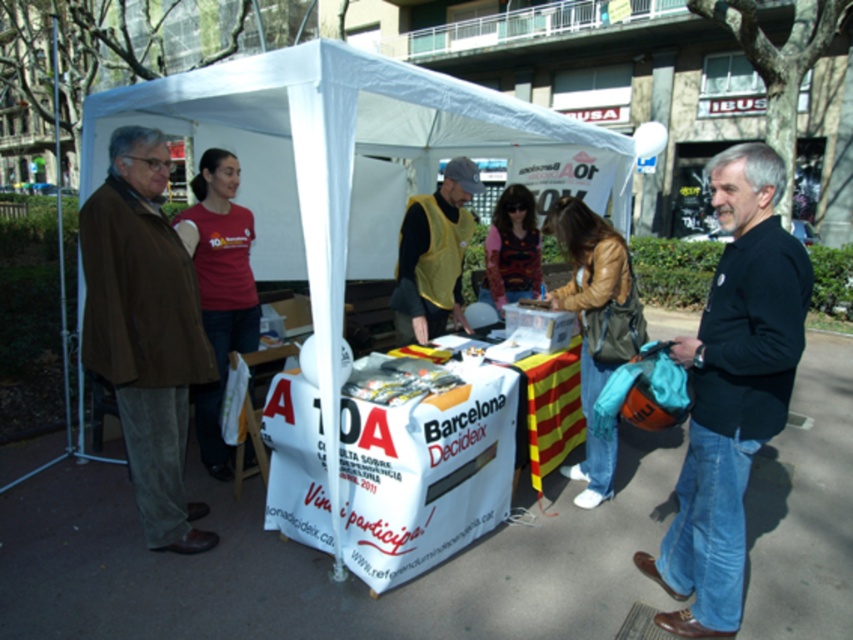
Question: Estimate the real-world distances between objects in this image. Which object is farther from the black matte shirt at right?

Choices:
 (A) yellow vest at center
 (B) brown corduroy jacket at left

Answer: (B)

Question: Which point is farther to the camera?

Choices:
 (A) brown corduroy jacket at left
 (B) white fabric canopy at center
 (C) yellow vest at center
 (D) black matte shirt at right

Answer: (C)

Question: Can you confirm if brown corduroy jacket at left is positioned below yellow vest at center?

Choices:
 (A) no
 (B) yes

Answer: (B)

Question: Estimate the real-world distances between objects in this image. Which object is farther from the brown corduroy jacket at left?

Choices:
 (A) black matte shirt at right
 (B) white fabric canopy at center
 (C) yellow vest at center

Answer: (A)

Question: Considering the relative positions of black matte shirt at right and brown corduroy jacket at left in the image provided, where is black matte shirt at right located with respect to brown corduroy jacket at left?

Choices:
 (A) right
 (B) left

Answer: (A)

Question: Is black matte shirt at right further to the viewer compared to yellow vest at center?

Choices:
 (A) no
 (B) yes

Answer: (A)